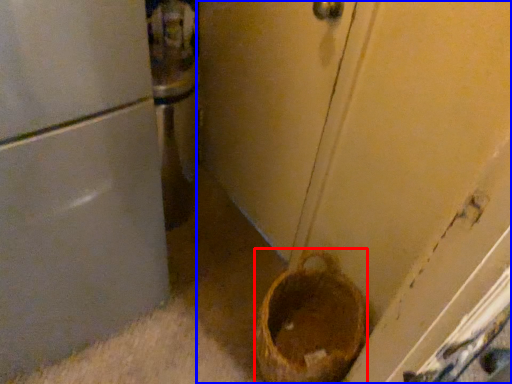
Question: Among these objects, which one is farthest to the camera, basket container (highlighted by a red box) or door (highlighted by a blue box)?

Choices:
 (A) basket container
 (B) door

Answer: (A)